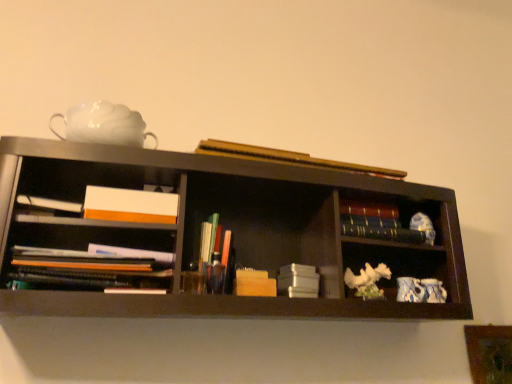
Question: Is matte black books at left, arranged as the 6th book when viewed from the right, turned away from wooden block at center, the third book positioned from the left?

Choices:
 (A) yes
 (B) no

Answer: (B)

Question: Is matte black books at left, the 1th book positioned from the left, taller than wooden block at center, marked as the fourth book in a right-to-left arrangement?

Choices:
 (A) no
 (B) yes

Answer: (B)

Question: From the image's perspective, does matte black books at left, arranged as the 6th book when viewed from the right, appear lower than wooden block at center, marked as the fourth book in a right-to-left arrangement?

Choices:
 (A) no
 (B) yes

Answer: (A)

Question: Is matte black books at left, arranged as the 6th book when viewed from the right, to the right of wooden block at center, marked as the fourth book in a right-to-left arrangement, from the viewer's perspective?

Choices:
 (A) no
 (B) yes

Answer: (A)

Question: Does matte black books at left, the 1th book positioned from the left, have a smaller size compared to wooden block at center, the third book positioned from the left?

Choices:
 (A) yes
 (B) no

Answer: (B)

Question: Is matte plastic pens at center, arranged as the 2th book when viewed from the left, in front of or behind white matte teapot at upper left in the image?

Choices:
 (A) front
 (B) behind

Answer: (B)

Question: From the image's perspective, is matte plastic pens at center, the fifth book positioned from the right, above or below white matte teapot at upper left?

Choices:
 (A) below
 (B) above

Answer: (A)

Question: Based on their sizes in the image, would you say matte plastic pens at center, the fifth book positioned from the right, is bigger or smaller than white matte teapot at upper left?

Choices:
 (A) big
 (B) small

Answer: (B)

Question: Visually, is matte plastic pens at center, the fifth book positioned from the right, positioned to the left or to the right of white matte teapot at upper left?

Choices:
 (A) right
 (B) left

Answer: (A)

Question: Visually, is wooden block at center, the third book positioned from the left, positioned to the left or to the right of blue and white porcelain teapot at lower right?

Choices:
 (A) left
 (B) right

Answer: (A)

Question: From a real-world perspective, is wooden block at center, marked as the fourth book in a right-to-left arrangement, positioned above or below blue and white porcelain teapot at lower right?

Choices:
 (A) above
 (B) below

Answer: (A)

Question: In terms of width, does wooden block at center, marked as the fourth book in a right-to-left arrangement, look wider or thinner when compared to blue and white porcelain teapot at lower right?

Choices:
 (A) wide
 (B) thin

Answer: (A)

Question: From the image's perspective, is wooden block at center, the third book positioned from the left, located above or below blue and white porcelain teapot at lower right?

Choices:
 (A) below
 (B) above

Answer: (B)

Question: Is point (409, 236) positioned closer to the camera than point (314, 157)?

Choices:
 (A) closer
 (B) farther

Answer: (B)

Question: Considering their positions, is dark blue hardcover book at center right, placed as the 6th book when sorted from left to right, located in front of or behind hardcover book at upper center, which is the 2th book in right-to-left order?

Choices:
 (A) behind
 (B) front

Answer: (A)